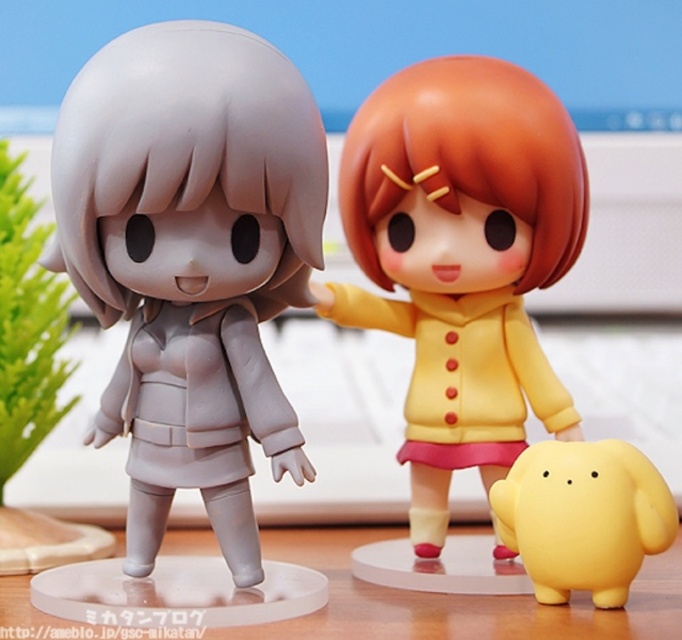
Question: Which point is farther from the camera taking this photo?

Choices:
 (A) (295, 481)
 (B) (584, 451)
 (C) (436, 435)

Answer: (C)

Question: Is transparent plastic table at center positioned before yellow matte plush at lower right?

Choices:
 (A) yes
 (B) no

Answer: (A)

Question: Considering the real-world distances, which object is farthest from the yellow matte plush at lower right?

Choices:
 (A) transparent plastic table at center
 (B) matte yellow plush at center
 (C) matte gray figurine at left

Answer: (C)

Question: Does matte gray figurine at left have a larger size compared to matte yellow plush at center?

Choices:
 (A) no
 (B) yes

Answer: (B)

Question: Which point is closer to the camera taking this photo?

Choices:
 (A) (119, 280)
 (B) (355, 228)
 (C) (542, 570)
 (D) (436, 612)

Answer: (A)

Question: Does matte yellow plush at center have a smaller size compared to transparent plastic table at center?

Choices:
 (A) no
 (B) yes

Answer: (A)